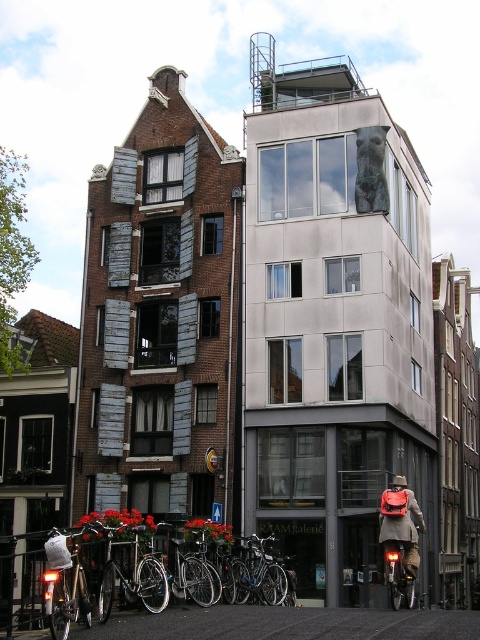
Question: Which of the following is the farthest from the observer?

Choices:
 (A) matte black backpack at lower right
 (B) shiny metallic bicycle at lower right
 (C) shiny silver bicycle at lower left

Answer: (A)

Question: Which point is farther to the camera?

Choices:
 (A) silver metallic bicycle at lower left
 (B) shiny silver bicycle at lower left
 (C) shiny metallic bicycle at lower right

Answer: (C)

Question: Which of the following is the closest to the observer?

Choices:
 (A) (402, 484)
 (B) (391, 566)
 (C) (87, 609)
 (D) (66, 556)

Answer: (D)

Question: Is shiny silver bicycle at lower left closer to the viewer compared to shiny metallic bicycle at lower right?

Choices:
 (A) yes
 (B) no

Answer: (A)

Question: Does silver metallic bicycle at lower left have a greater width compared to shiny silver bicycle at lower left?

Choices:
 (A) no
 (B) yes

Answer: (B)

Question: Does shiny silver bicycle at lower left come in front of matte black backpack at lower right?

Choices:
 (A) no
 (B) yes

Answer: (B)